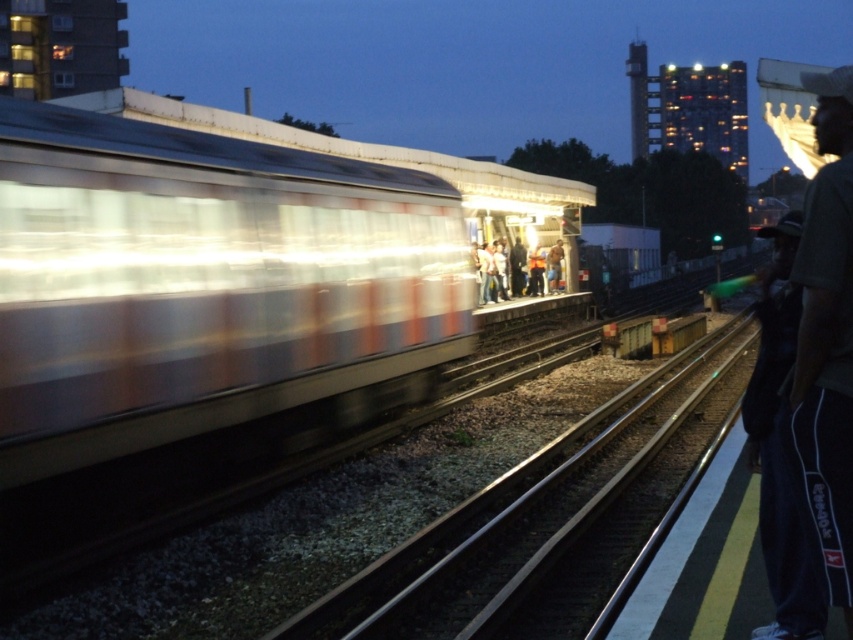
Question: Which point is farther to the camera?

Choices:
 (A) metallic silver train at left
 (B) blue jeans at center

Answer: (B)

Question: Which object is closer to the camera taking this photo?

Choices:
 (A) metallic silver train at left
 (B) dark gray reebok track pants at right

Answer: (B)

Question: Does metallic silver train at left have a smaller size compared to blue jeans at center?

Choices:
 (A) no
 (B) yes

Answer: (A)

Question: Is metallic silver train at left bigger than blue jeans at center?

Choices:
 (A) yes
 (B) no

Answer: (A)

Question: Is metallic silver train at left wider than blue jeans at center?

Choices:
 (A) yes
 (B) no

Answer: (A)

Question: Which object is closer to the camera taking this photo?

Choices:
 (A) dark gray reebok track pants at right
 (B) metallic silver train at left
 (C) blue jeans at center

Answer: (A)